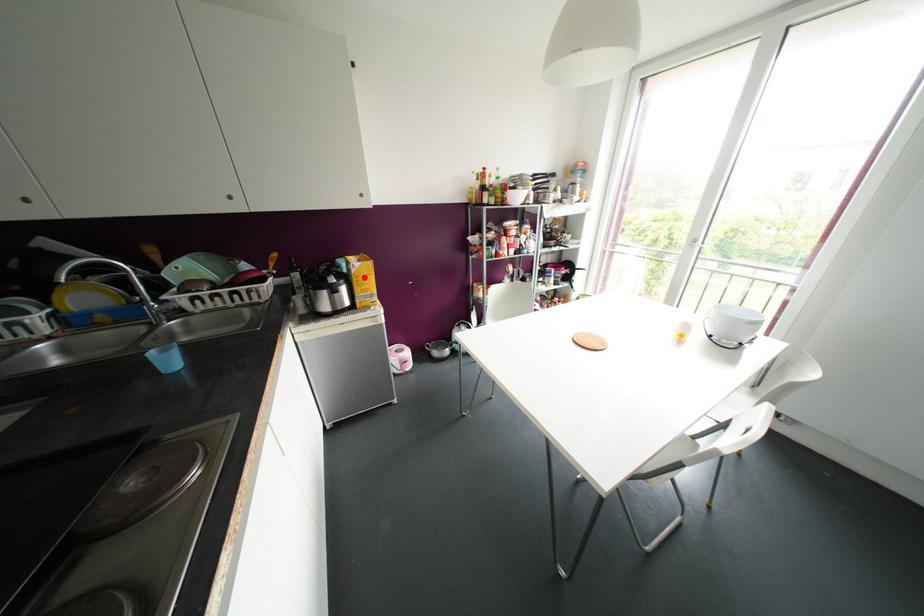
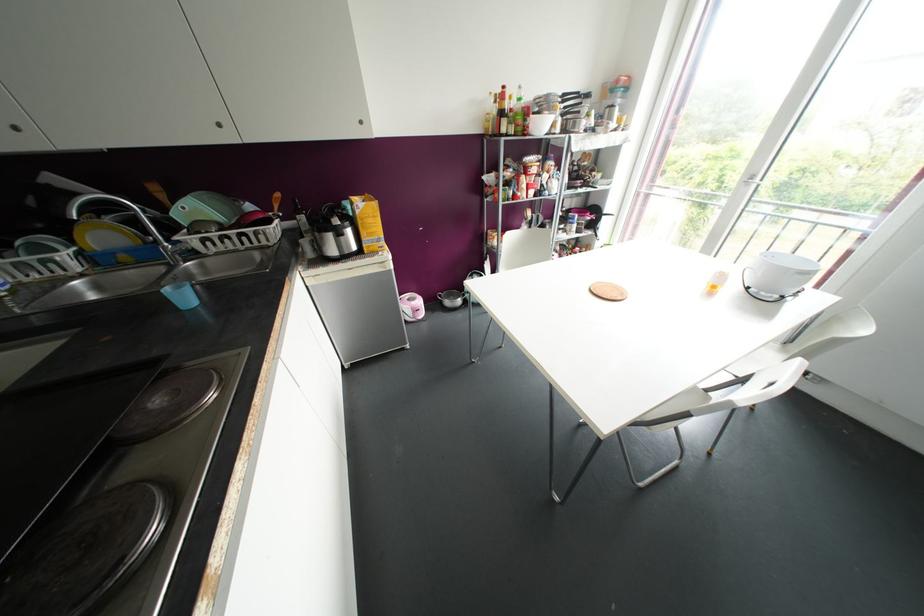
Where in the second image is the point corresponding to the highlighted location from the first image?

(370, 220)